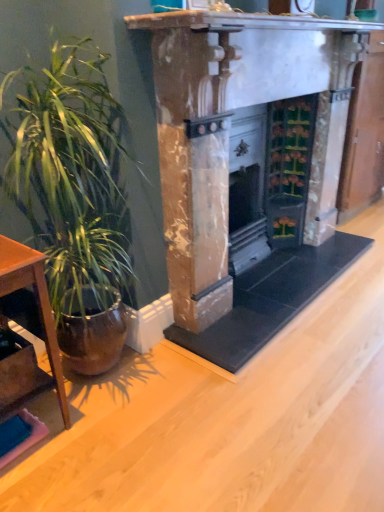
The height and width of the screenshot is (512, 384). In order to click on brown wooden table at left in this screenshot , I will do point(38,302).

Describe the element at coordinates (38, 302) in the screenshot. This screenshot has height=512, width=384. I see `brown wooden table at left` at that location.

Locate an element on the screen. The height and width of the screenshot is (512, 384). marble fireplace at center is located at coordinates (246, 167).

This screenshot has width=384, height=512. In order to click on green glossy plant at left in this screenshot , I will do `click(70, 174)`.

The width and height of the screenshot is (384, 512). What are the coordinates of `fireplace to the right of brown wooden table at left` in the screenshot? It's located at (246, 167).

Considering the relative sizes of brown wooden table at left and marble fireplace at center in the image provided, is brown wooden table at left thinner than marble fireplace at center?

Yes, brown wooden table at left is thinner than marble fireplace at center.

How distant is brown wooden table at left from marble fireplace at center?

They are 3.96 feet apart.

Is point (56, 345) closer or farther from the camera than point (206, 91)?

Point (56, 345).

Is marble fireplace at center a part of green glossy plant at left?

No, marble fireplace at center is not a part of green glossy plant at left.

Between green glossy plant at left and marble fireplace at center, which one has smaller size?

green glossy plant at left.

In terms of width, does green glossy plant at left look wider or thinner when compared to marble fireplace at center?

green glossy plant at left is thinner than marble fireplace at center.

From the image's perspective, which is below, green glossy plant at left or marble fireplace at center?

green glossy plant at left is shown below in the image.

From the image's perspective, is marble fireplace at center positioned above or below brown wooden table at left?

marble fireplace at center is situated higher than brown wooden table at left in the image.

Does point (253, 303) lie in front of point (50, 313)?

No, (253, 303) is behind (50, 313).

Does marble fireplace at center turn towards brown wooden table at left?

No, marble fireplace at center is not turned towards brown wooden table at left.

Who is more distant, brown wooden table at left or green glossy plant at left?

brown wooden table at left is more distant.

Based on the photo, is the surface of brown wooden table at left in direct contact with green glossy plant at left?

No, brown wooden table at left is not with green glossy plant at left.

Based on the photo, based on their positions, is brown wooden table at left located to the left or right of green glossy plant at left?

Based on their positions, brown wooden table at left is located to the left of green glossy plant at left.

Between marble fireplace at center and green glossy plant at left, which one has more height?

Standing taller between the two is green glossy plant at left.

Does marble fireplace at center have a lesser width compared to green glossy plant at left?

No, marble fireplace at center is not thinner than green glossy plant at left.

Is marble fireplace at center positioned behind green glossy plant at left?

Yes, it is.

Does marble fireplace at center have a larger size compared to green glossy plant at left?

Yes.

Who is smaller, green glossy plant at left or brown wooden table at left?

With smaller size is brown wooden table at left.

Does green glossy plant at left have a greater height compared to brown wooden table at left?

Correct, green glossy plant at left is much taller as brown wooden table at left.

Would you consider green glossy plant at left to be distant from brown wooden table at left?

No, there isn't a large distance between green glossy plant at left and brown wooden table at left.

Find the location of `houseplant above the brown wooden table at left (from a real-world perspective)`. houseplant above the brown wooden table at left (from a real-world perspective) is located at coordinates pyautogui.click(x=70, y=174).

This screenshot has height=512, width=384. Find the location of `table on the left of marble fireplace at center`. table on the left of marble fireplace at center is located at coordinates (38, 302).

Locate an element on the screen. fireplace on the right side of green glossy plant at left is located at coordinates (246, 167).

Looking at the image, which one is located further to green glossy plant at left, marble fireplace at center or brown wooden table at left?

The object further to green glossy plant at left is marble fireplace at center.

Considering their positions, is marble fireplace at center positioned closer to brown wooden table at left than green glossy plant at left?

A: Among the two, green glossy plant at left is located nearer to brown wooden table at left.

From the image, which object appears to be farther from marble fireplace at center, brown wooden table at left or green glossy plant at left?

brown wooden table at left is positioned further to the anchor marble fireplace at center.

Looking at the image, which one is located further to marble fireplace at center, green glossy plant at left or brown wooden table at left?

brown wooden table at left lies further to marble fireplace at center than the other object.

Looking at the image, which one is located further to brown wooden table at left, green glossy plant at left or marble fireplace at center?

marble fireplace at center.

In the scene shown: Based on their spatial positions, is brown wooden table at left or marble fireplace at center closer to green glossy plant at left?

Based on the image, brown wooden table at left appears to be nearer to green glossy plant at left.

Find the location of a particular element. Image resolution: width=384 pixels, height=512 pixels. houseplant between brown wooden table at left and marble fireplace at center from left to right is located at coordinates (70, 174).